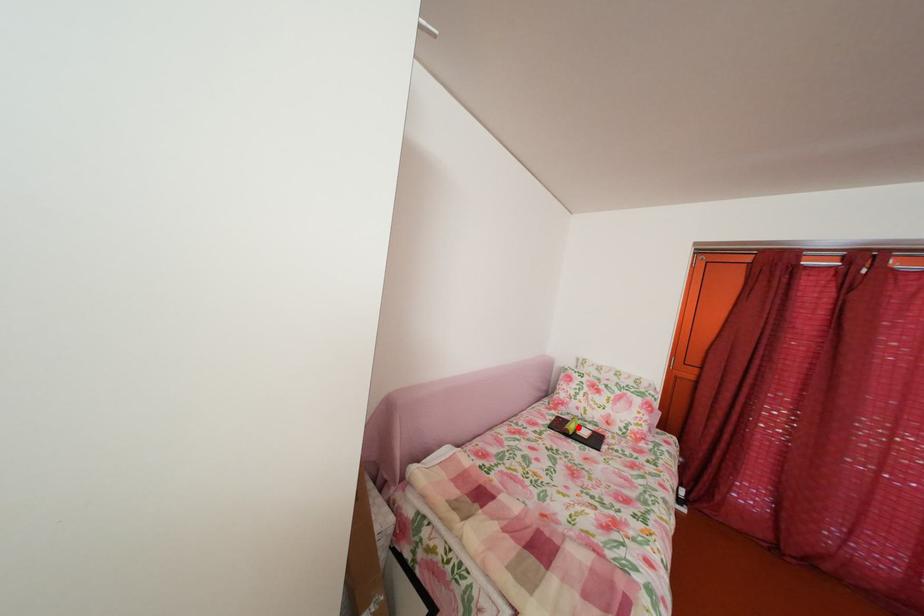
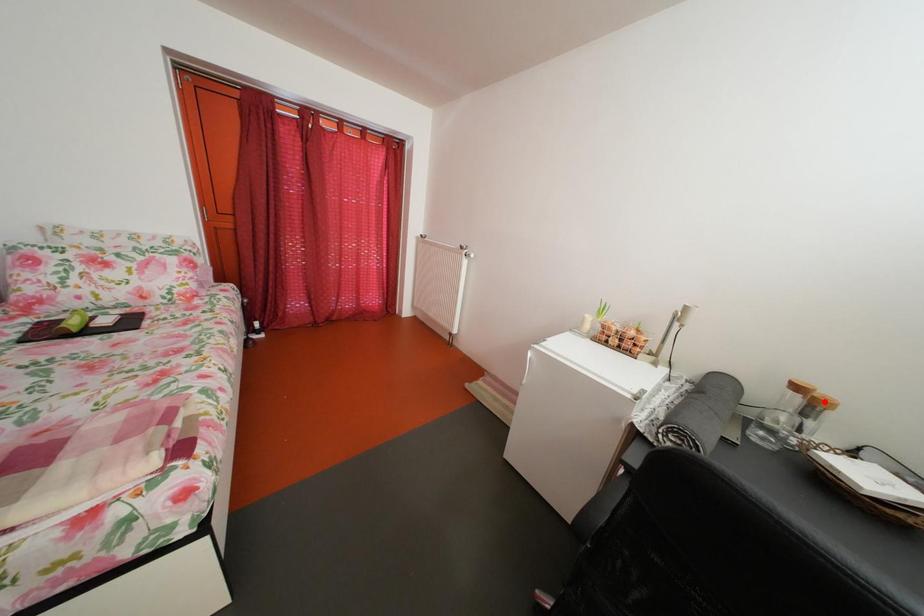
I am providing you with two images of the same scene from different viewpoints. A red point is marked on the first image and another point is marked on the second image. Does the point marked in image1 correspond to the same location as the one in image2?

No